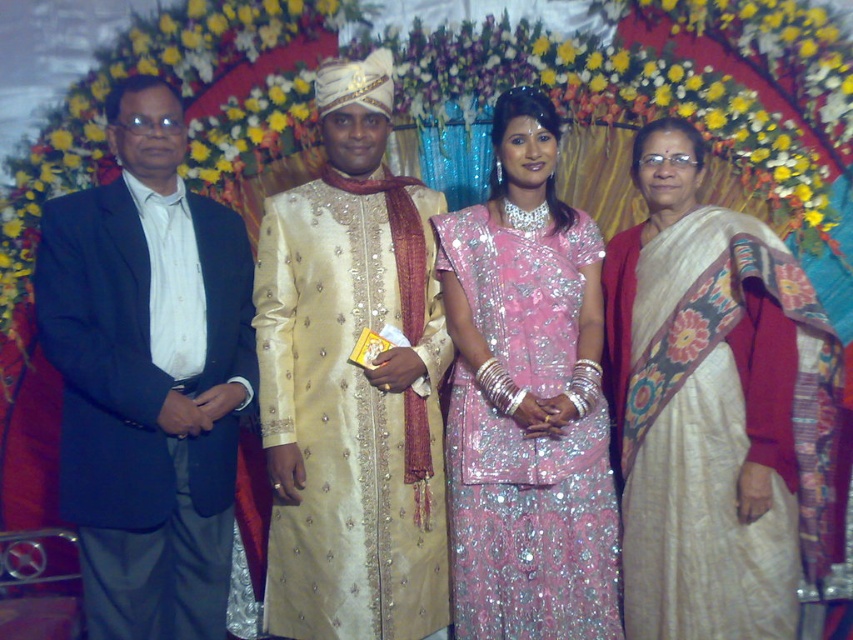
You are a photographer setting up for a group photo. You need to ensure that the dark blue suit at left and the pink sequined saree at center are both visible in the frame. Based on their positions, which one might require more space to accommodate their attire?

The dark blue suit at left might require more space as it is wider than the pink sequined saree at center according to the description.

You are a photographer adjusting your camera settings. You notice the white silk saree at right and the gold silk sherwani at center in your frame. Which of these two items is positioned closer to the front of the scene?

The white silk saree at right is closer to the viewer than the gold silk sherwani at center, so the white silk saree at right is positioned closer to the front of the scene.